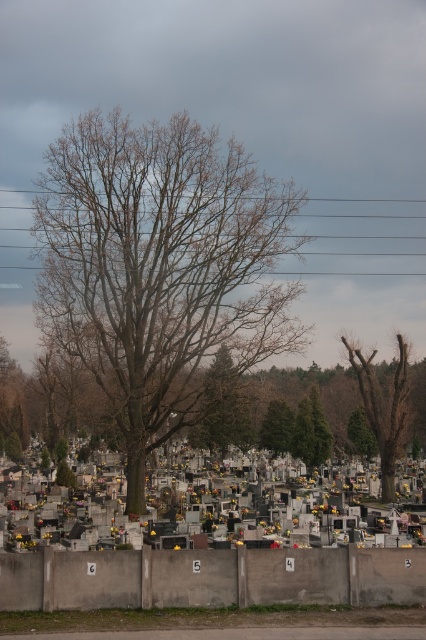
Looking at this image, does bare wood tree at center appear on the right side of green matte tree at center?

No, bare wood tree at center is not to the right of green matte tree at center.

Describe the element at coordinates (160, 268) in the screenshot. I see `bare wood tree at center` at that location.

Between point (120, 200) and point (267, 444), which one is positioned in front?

Point (120, 200)

Where is `bare wood tree at center`? bare wood tree at center is located at coordinates (160, 268).

The image size is (426, 640). Describe the element at coordinates (383, 406) in the screenshot. I see `bare wood tree at right` at that location.

Between bare wood tree at right and green textured tree at center, which one has less height?

With less height is bare wood tree at right.

This screenshot has height=640, width=426. I want to click on bare wood tree at right, so click(x=383, y=406).

Image resolution: width=426 pixels, height=640 pixels. What are the coordinates of `bare wood tree at center` in the screenshot? It's located at (160, 268).

The width and height of the screenshot is (426, 640). Describe the element at coordinates (160, 268) in the screenshot. I see `bare wood tree at center` at that location.

Does point (198, 188) come in front of point (365, 390)?

Yes.

This screenshot has width=426, height=640. Find the location of `bare wood tree at center`. bare wood tree at center is located at coordinates (160, 268).